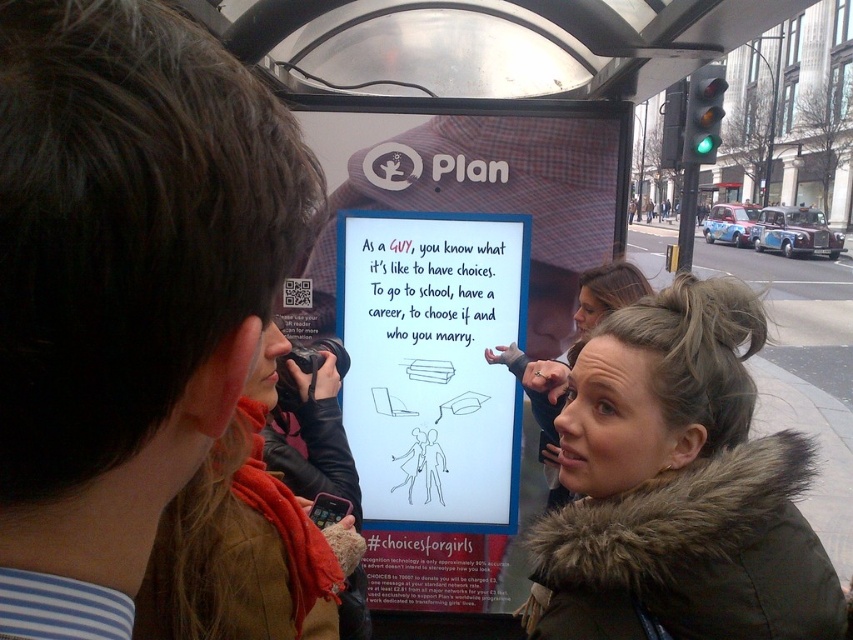
Between dark brown hair at upper left and red scarf at center, which one is positioned lower?

red scarf at center is lower down.

Can you confirm if dark brown hair at upper left is thinner than red scarf at center?

Indeed, dark brown hair at upper left has a lesser width compared to red scarf at center.

At what (x,y) coordinates should I click in order to perform the action: click on dark brown hair at upper left. Please return your answer as a coordinate pair (x, y). Looking at the image, I should click on (125, 288).

How far apart are white paperboard at center and red scarf at center?

white paperboard at center and red scarf at center are 1.93 meters apart from each other.

Can you confirm if white paperboard at center is smaller than red scarf at center?

Incorrect, white paperboard at center is not smaller in size than red scarf at center.

The image size is (853, 640). Describe the element at coordinates (432, 364) in the screenshot. I see `white paperboard at center` at that location.

Find the location of a particular element. Image resolution: width=853 pixels, height=640 pixels. white paperboard at center is located at coordinates (432, 364).

Which is below, brown fur coat at center or red scarf at center?

brown fur coat at center is below.

Which is behind, point (650, 616) or point (256, 502)?

The point (650, 616) is behind.

Does point (556, 609) come behind point (335, 544)?

No, it is in front of (335, 544).

Where is `brown fur coat at center`? This screenshot has width=853, height=640. brown fur coat at center is located at coordinates (679, 484).